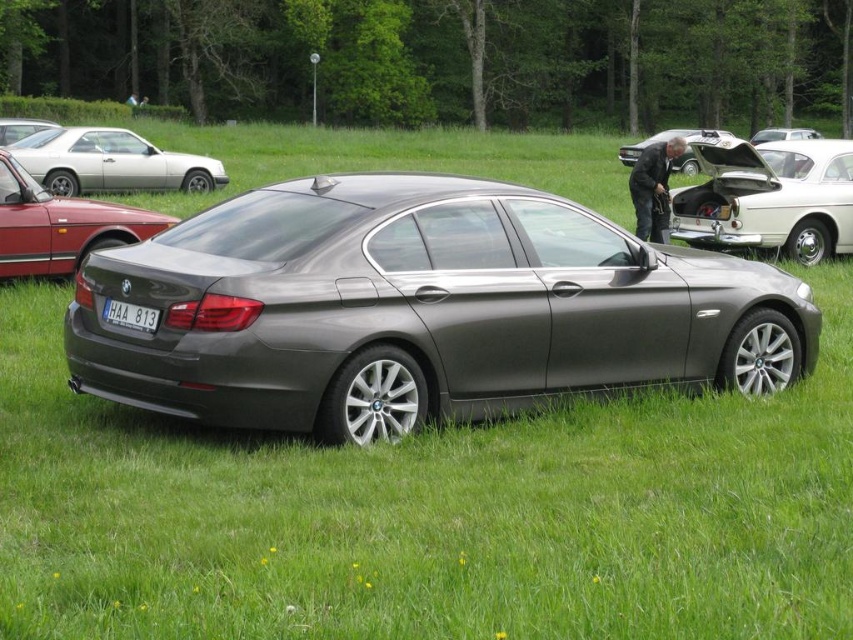
Question: Does metallic silver car at center appear over white plastic license plate at center?

Choices:
 (A) yes
 (B) no

Answer: (A)

Question: Does white plastic license plate at center come behind metallic silver sedan at center?

Choices:
 (A) yes
 (B) no

Answer: (B)

Question: Which is farther from the metallic silver car at center?

Choices:
 (A) satin metallic sedan at center
 (B) metallic silver coupe at upper left
 (C) dark gray suit at center

Answer: (B)

Question: Among these objects, which one is farthest from the camera?

Choices:
 (A) metallic silver coupe at upper left
 (B) metallic gray car at center
 (C) metallic red car at left

Answer: (A)

Question: Which object is the closest to the metallic red car at left?

Choices:
 (A) metallic silver sedan at center
 (B) metallic silver car at center
 (C) white plastic license plate at center
 (D) satin metallic sedan at center

Answer: (C)

Question: Where is dark gray suit at center located in relation to white plastic license plate at center in the image?

Choices:
 (A) left
 (B) right

Answer: (B)